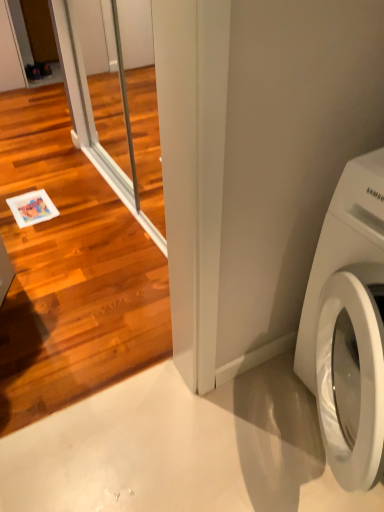
Question: Is clear glass screen door at upper left, which ranks as the second screen door in back-to-front order, positioned before white glossy washing machine at lower right?

Choices:
 (A) no
 (B) yes

Answer: (B)

Question: Is clear glass screen door at upper left, the 1th screen door positioned from the front, smaller than white glossy washing machine at lower right?

Choices:
 (A) yes
 (B) no

Answer: (A)

Question: Can you confirm if clear glass screen door at upper left, which ranks as the second screen door in back-to-front order, is wider than white glossy washing machine at lower right?

Choices:
 (A) yes
 (B) no

Answer: (B)

Question: Considering the relative positions of clear glass screen door at upper left, the 1th screen door positioned from the front, and white glossy washing machine at lower right in the image provided, is clear glass screen door at upper left, the 1th screen door positioned from the front, to the left of white glossy washing machine at lower right from the viewer's perspective?

Choices:
 (A) yes
 (B) no

Answer: (A)

Question: Is clear glass screen door at upper left, the 1th screen door positioned from the front, beside white glossy washing machine at lower right?

Choices:
 (A) yes
 (B) no

Answer: (B)

Question: Considering the positions of point (339, 480) and point (77, 365), is point (339, 480) closer or farther from the camera than point (77, 365)?

Choices:
 (A) closer
 (B) farther

Answer: (A)

Question: Looking at their shapes, would you say white glossy washing machine at lower right is wider or thinner than clear glass screen door at upper left, which ranks as the second screen door in back-to-front order?

Choices:
 (A) thin
 (B) wide

Answer: (B)

Question: From their relative heights in the image, would you say white glossy washing machine at lower right is taller or shorter than clear glass screen door at upper left, the 1th screen door positioned from the front?

Choices:
 (A) short
 (B) tall

Answer: (A)

Question: Is white glossy washing machine at lower right to the left or to the right of clear glass screen door at upper left, the 1th screen door positioned from the front, in the image?

Choices:
 (A) left
 (B) right

Answer: (B)

Question: Is clear glass screen door at left, positioned as the first screen door in back-to-front order, taller or shorter than clear glass screen door at upper left, which ranks as the second screen door in back-to-front order?

Choices:
 (A) tall
 (B) short

Answer: (B)

Question: From a real-world perspective, is clear glass screen door at left, positioned as the first screen door in back-to-front order, above or below clear glass screen door at upper left, the 1th screen door positioned from the front?

Choices:
 (A) below
 (B) above

Answer: (A)

Question: Looking at the image, does clear glass screen door at left, arranged as the second screen door when viewed from the front, seem bigger or smaller compared to clear glass screen door at upper left, which ranks as the second screen door in back-to-front order?

Choices:
 (A) small
 (B) big

Answer: (B)

Question: Is clear glass screen door at left, arranged as the second screen door when viewed from the front, to the left or to the right of clear glass screen door at upper left, which ranks as the second screen door in back-to-front order, in the image?

Choices:
 (A) right
 (B) left

Answer: (B)

Question: Looking at their shapes, would you say clear glass screen door at upper left, which ranks as the second screen door in back-to-front order, is wider or thinner than clear glass screen door at left, arranged as the second screen door when viewed from the front?

Choices:
 (A) wide
 (B) thin

Answer: (A)

Question: Visually, is clear glass screen door at upper left, which ranks as the second screen door in back-to-front order, positioned to the left or to the right of clear glass screen door at left, positioned as the first screen door in back-to-front order?

Choices:
 (A) right
 (B) left

Answer: (A)